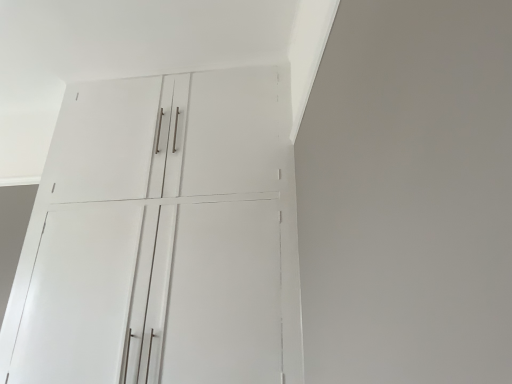
Find the location of `matte white cupboard at center`. matte white cupboard at center is located at coordinates point(162,237).

What do you see at coordinates (162, 237) in the screenshot? I see `matte white cupboard at center` at bounding box center [162, 237].

Locate an element on the screen. This screenshot has width=512, height=384. matte white cupboard at center is located at coordinates (162, 237).